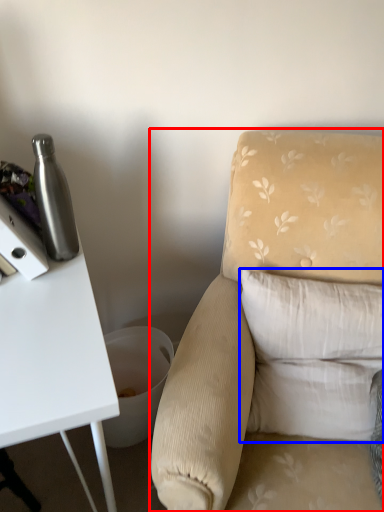
Question: Which object appears closest to the camera in this image, chair (highlighted by a red box) or pillow (highlighted by a blue box)?

Choices:
 (A) chair
 (B) pillow

Answer: (A)